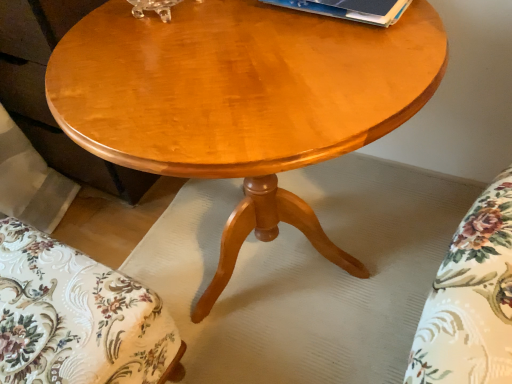
Consider the image. In order to face glossy wood coffee table at center, should I rotate leftwards or rightwards?

Turn left approximately 1.944 degrees to face it.

Image resolution: width=512 pixels, height=384 pixels. Find the location of `blue paper at upper center`. blue paper at upper center is located at coordinates (350, 9).

This screenshot has height=384, width=512. I want to click on floral fabric cushion at lower left, so click(x=76, y=317).

Does blue paper at upper center have a larger size compared to floral fabric cushion at lower left?

Incorrect, blue paper at upper center is not larger than floral fabric cushion at lower left.

From the picture: Which of these two, blue paper at upper center or floral fabric cushion at lower left, is thinner?

blue paper at upper center.

From the image's perspective, is blue paper at upper center beneath floral fabric cushion at lower left?

No.

Is the surface of blue paper at upper center in direct contact with floral fabric cushion at lower left?

They are not placed beside each other.

Can you confirm if glossy wood coffee table at center is bigger than blue paper at upper center?

Yes, glossy wood coffee table at center is bigger than blue paper at upper center.

Are glossy wood coffee table at center and blue paper at upper center beside each other?

glossy wood coffee table at center and blue paper at upper center are clearly separated.

From the image's perspective, is glossy wood coffee table at center on top of blue paper at upper center?

Actually, glossy wood coffee table at center appears below blue paper at upper center in the image.

Is glossy wood coffee table at center wider or thinner than blue paper at upper center?

glossy wood coffee table at center is wider than blue paper at upper center.

Is glossy wood coffee table at center not within floral fabric cushion at lower left?

Indeed, glossy wood coffee table at center is completely outside floral fabric cushion at lower left.

Is glossy wood coffee table at center looking in the opposite direction of floral fabric cushion at lower left?

glossy wood coffee table at center is not turned away from floral fabric cushion at lower left.

Which is in front, glossy wood coffee table at center or floral fabric cushion at lower left?

Positioned in front is glossy wood coffee table at center.

Is glossy wood coffee table at center next to floral fabric cushion at lower left and touching it?

glossy wood coffee table at center is not next to floral fabric cushion at lower left, and they're not touching.

Would you say blue paper at upper center is outside glossy wood coffee table at center?

Actually, blue paper at upper center is within glossy wood coffee table at center.

Is there a large distance between blue paper at upper center and glossy wood coffee table at center?

No, blue paper at upper center is not far from glossy wood coffee table at center.

Between blue paper at upper center and glossy wood coffee table at center, which one has larger width?

glossy wood coffee table at center is wider.

Considering the positions of objects floral fabric cushion at lower left and blue paper at upper center in the image provided, who is more to the left, floral fabric cushion at lower left or blue paper at upper center?

Positioned to the left is floral fabric cushion at lower left.

Consider the image. Between floral fabric cushion at lower left and blue paper at upper center, which one has less height?

With less height is blue paper at upper center.

Is floral fabric cushion at lower left placed right next to blue paper at upper center?

They are not placed beside each other.

Considering the relative sizes of floral fabric cushion at lower left and blue paper at upper center in the image provided, is floral fabric cushion at lower left wider than blue paper at upper center?

Indeed, floral fabric cushion at lower left has a greater width compared to blue paper at upper center.

Is floral fabric cushion at lower left further to camera compared to glossy wood coffee table at center?

Yes, it is behind glossy wood coffee table at center.

Does floral fabric cushion at lower left have a greater width compared to glossy wood coffee table at center?

In fact, floral fabric cushion at lower left might be narrower than glossy wood coffee table at center.

Who is bigger, floral fabric cushion at lower left or glossy wood coffee table at center?

Bigger between the two is glossy wood coffee table at center.

Could you tell me if floral fabric cushion at lower left is turned towards glossy wood coffee table at center?

Yes, floral fabric cushion at lower left faces towards glossy wood coffee table at center.

Where is `swivel chair in front of the blue paper at upper center`? The image size is (512, 384). swivel chair in front of the blue paper at upper center is located at coordinates (76, 317).

The width and height of the screenshot is (512, 384). I want to click on paperback book that is behind the glossy wood coffee table at center, so click(350, 9).

Which object lies further to the anchor point blue paper at upper center, floral fabric cushion at lower left or glossy wood coffee table at center?

floral fabric cushion at lower left is further to blue paper at upper center.

Considering their positions, is floral fabric cushion at lower left positioned closer to glossy wood coffee table at center than blue paper at upper center?

blue paper at upper center.

Estimate the real-world distances between objects in this image. Which object is closer to floral fabric cushion at lower left, glossy wood coffee table at center or blue paper at upper center?

Among the two, glossy wood coffee table at center is located nearer to floral fabric cushion at lower left.

When comparing their distances from blue paper at upper center, does glossy wood coffee table at center or floral fabric cushion at lower left seem closer?

glossy wood coffee table at center is positioned closer to the anchor blue paper at upper center.

Considering their positions, is blue paper at upper center positioned closer to glossy wood coffee table at center than floral fabric cushion at lower left?

Based on the image, blue paper at upper center appears to be nearer to glossy wood coffee table at center.

Considering their positions, is blue paper at upper center positioned closer to floral fabric cushion at lower left than glossy wood coffee table at center?

glossy wood coffee table at center is closer to floral fabric cushion at lower left.

Where is `coffee table between blue paper at upper center and floral fabric cushion at lower left in the vertical direction`? This screenshot has width=512, height=384. coffee table between blue paper at upper center and floral fabric cushion at lower left in the vertical direction is located at coordinates (241, 100).